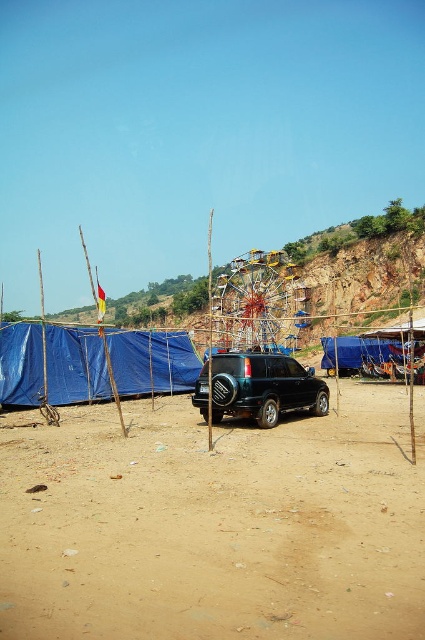
You are standing at the point marked by the coordinates point (152, 362) in the image. What structure are you facing?

The point (152, 362) indicates the location of the blue tarpaulin tent at left, so you are facing the blue tarpaulin tent at left.

Consider the image. You are a delivery person who needs to place a large package between the blue tarpaulin tent at left and the satin black suv at center. The package requires 15 meters of space. Can you fit it between them?

The blue tarpaulin tent at left and the satin black suv at center are 17.64 meters apart from each other. Since the required space is 15 meters, the package can be placed between them as there is enough space.

You are planning to set up a temporary shelter for an event. You have both the blue tarpaulin tent at left and the metallic yellow ferris wheel at center available. Which one would require more space to install?

The metallic yellow ferris wheel at center requires more space because the blue tarpaulin tent at left occupies less space than it.